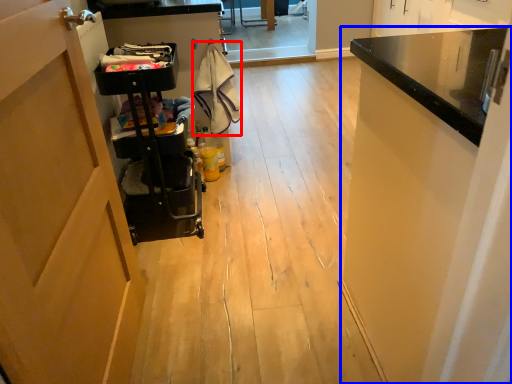
Question: Which object is closer to the camera taking this photo, laundry (highlighted by a red box) or cabinetry (highlighted by a blue box)?

Choices:
 (A) laundry
 (B) cabinetry

Answer: (B)